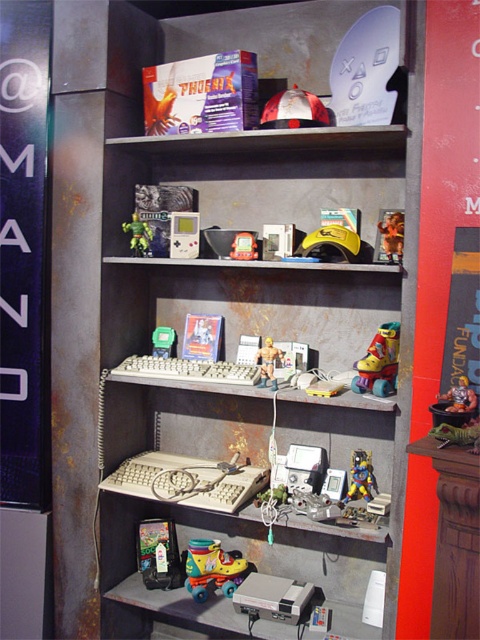
Question: Can you confirm if rusty metal bookshelf at center is positioned to the left of yellow rubber roller skates at center?

Choices:
 (A) yes
 (B) no

Answer: (A)

Question: Is metallic plastic action figure at lower right above shiny plastic game console at center?

Choices:
 (A) no
 (B) yes

Answer: (A)

Question: Can you confirm if metallic yellow roller skates at center is smaller than metallic plastic action figure at lower right?

Choices:
 (A) no
 (B) yes

Answer: (A)

Question: Which object is farther from the camera taking this photo?

Choices:
 (A) shiny plastic game console at center
 (B) yellow rubber roller skates at lower center

Answer: (B)

Question: Which object is positioned farthest from the metallic plastic action figure at lower right?

Choices:
 (A) green plastic toy at center
 (B) yellow rubber roller skates at center
 (C) rusty metal bookshelf at center
 (D) plastic action figure at center

Answer: (A)

Question: Which is nearer to the yellow rubber roller skates at center?

Choices:
 (A) green plastic game console at center
 (B) metallic plastic action figure at lower right
 (C) yellow rubber roller skates at lower center

Answer: (B)